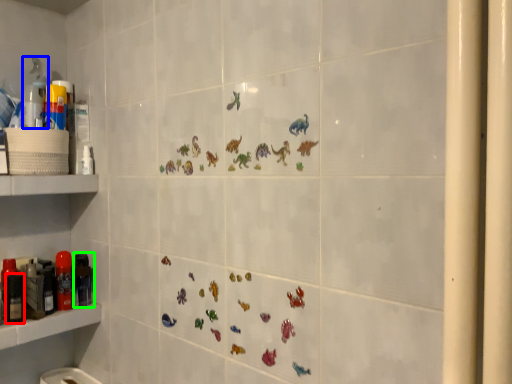
Question: Which object is the farthest from toiletry (highlighted by a red box)? Choose among these: cleaning product (highlighted by a blue box) or toiletry (highlighted by a green box).

Choices:
 (A) cleaning product
 (B) toiletry

Answer: (A)